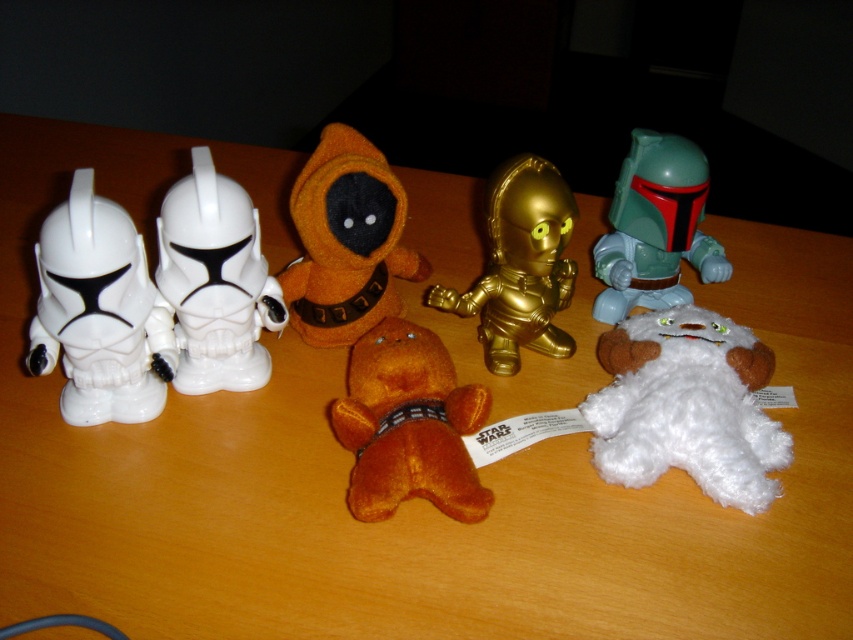
Does point (601, 413) come in front of point (416, 340)?

No, it is not.

Identify the location of white fluffy stuffed toy at lower right. (686, 406).

Which is behind, point (618, 344) or point (393, 410)?

The point (618, 344) is behind.

Find the location of `white fluffy stuffed toy at lower right`. white fluffy stuffed toy at lower right is located at coordinates (686, 406).

Which is behind, point (100, 413) or point (306, 320)?

The point (306, 320) is more distant.

Is white glossy plastic toy at left to the left of orange plush at center from the viewer's perspective?

Indeed, white glossy plastic toy at left is positioned on the left side of orange plush at center.

Measure the distance between white glossy plastic toy at left and camera.

white glossy plastic toy at left and camera are 28.02 inches apart from each other.

Image resolution: width=853 pixels, height=640 pixels. In order to click on white glossy plastic toy at left in this screenshot , I will do `click(99, 312)`.

Can you confirm if fuzzy orange bear at center is positioned below orange plush at center?

Correct, fuzzy orange bear at center is located below orange plush at center.

Is point (363, 344) positioned before point (374, 202)?

Yes, point (363, 344) is closer to viewer.

You are a GUI agent. You are given a task and a screenshot of the screen. Output one action in this format:
    pyautogui.click(x=<x>, y=<y>)
    Task: Click on the fuzzy orange bear at center
    
    Given the screenshot: What is the action you would take?
    pyautogui.click(x=408, y=426)